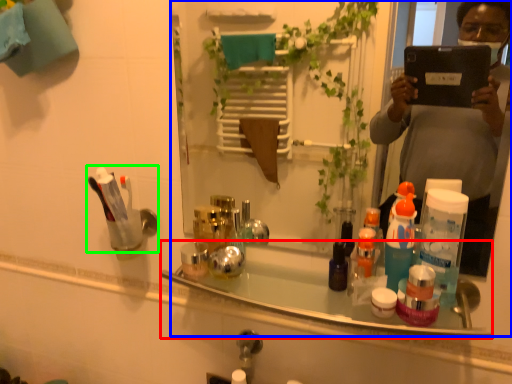
Question: Estimate the real-world distances between objects in this image. Which object is closer to bath (highlighted by a red box), mirror (highlighted by a blue box) or toiletry (highlighted by a green box)?

Choices:
 (A) mirror
 (B) toiletry

Answer: (B)